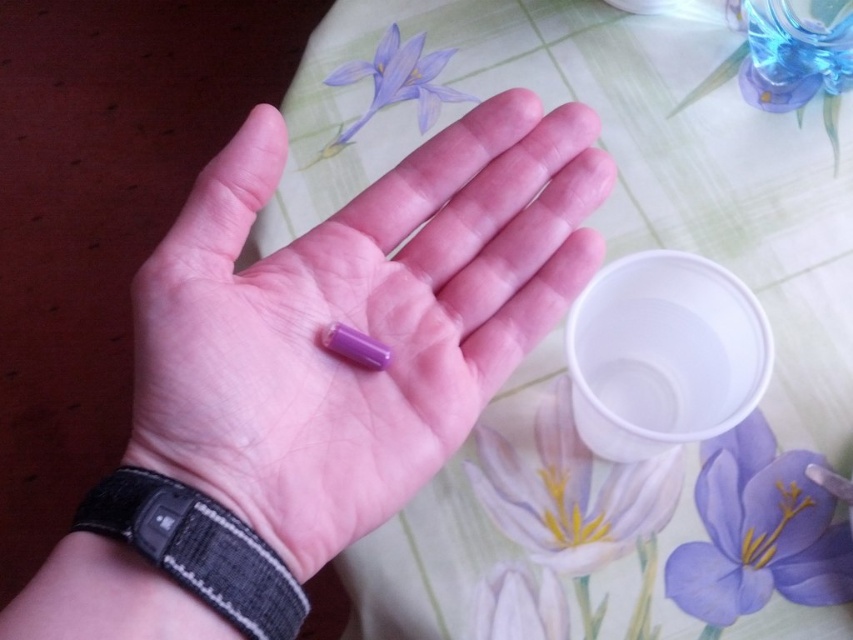
Question: Does purple matte flower at center appear over matte purple flower at upper center?

Choices:
 (A) yes
 (B) no

Answer: (B)

Question: Which of these objects is positioned closest to the black fabric wristband at lower left?

Choices:
 (A) purple matte flower at center
 (B) transparent plastic cup at lower right
 (C) floral-patterned fabric at center
 (D) purple matte pill at center

Answer: (D)

Question: Which object is the closest to the purple matte flower at lower center?

Choices:
 (A) purple matte flower at center
 (B) white glossy cup at lower center
 (C) floral-patterned fabric at center
 (D) matte purple flower at upper center

Answer: (B)

Question: Does matte purple flower at upper center appear under purple matte flower at lower center?

Choices:
 (A) yes
 (B) no

Answer: (B)

Question: Is purple matte pill at center wider than white glossy cup at lower center?

Choices:
 (A) no
 (B) yes

Answer: (B)

Question: Which point is closer to the camera taking this photo?

Choices:
 (A) (308, 605)
 (B) (575, 400)
 (C) (743, 600)

Answer: (A)